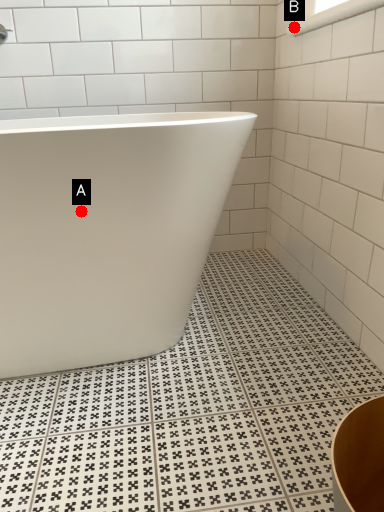
Question: Two points are circled on the image, labeled by A and B beside each circle. Which point appears farthest from the camera in this image?

Choices:
 (A) A is further
 (B) B is further

Answer: (B)